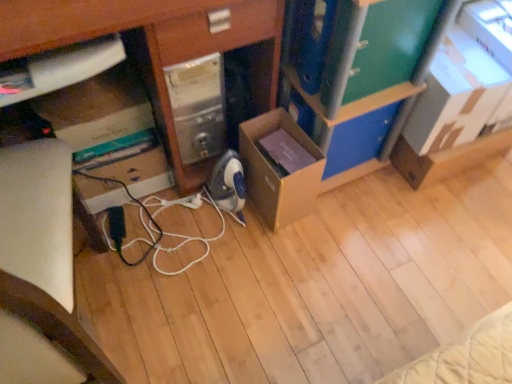
Question: From the image's perspective, is green matte drawer at upper right, the 1th drawer viewed from the top, above blue plastic drawer at center, which is the 1th drawer in bottom-to-top order?

Choices:
 (A) no
 (B) yes

Answer: (B)

Question: Does green matte drawer at upper right, arranged as the second drawer when viewed from the back, appear on the left side of blue plastic drawer at center, which is the 1th drawer in bottom-to-top order?

Choices:
 (A) yes
 (B) no

Answer: (A)

Question: Is blue plastic drawer at center, which is the 1th drawer in bottom-to-top order, a part of green matte drawer at upper right, arranged as the second drawer when viewed from the back?

Choices:
 (A) yes
 (B) no

Answer: (B)

Question: Does green matte drawer at upper right, the 2th drawer when ordered from bottom to top, have a lesser height compared to blue plastic drawer at center, which is the 1th drawer in bottom-to-top order?

Choices:
 (A) yes
 (B) no

Answer: (B)

Question: Is green matte drawer at upper right, the 1th drawer viewed from the top, thinner than blue plastic drawer at center, which ranks as the second drawer in top-to-bottom order?

Choices:
 (A) yes
 (B) no

Answer: (B)

Question: From a real-world perspective, is green matte drawer at upper right, the 1th drawer viewed from the top, on top of blue plastic drawer at center, which ranks as the second drawer in top-to-bottom order?

Choices:
 (A) yes
 (B) no

Answer: (A)

Question: Is the depth of cardboard box at upper right, which appears as the second cardboard box when viewed from the left, less than that of blue plastic drawer at center, which is the 1th drawer in bottom-to-top order?

Choices:
 (A) yes
 (B) no

Answer: (A)

Question: From a real-world perspective, does cardboard box at upper right, which appears as the second cardboard box when viewed from the left, stand above blue plastic drawer at center, which ranks as the second drawer in top-to-bottom order?

Choices:
 (A) no
 (B) yes

Answer: (B)

Question: Is cardboard box at upper right, the first cardboard box from the right, smaller than blue plastic drawer at center, which ranks as the second drawer in top-to-bottom order?

Choices:
 (A) yes
 (B) no

Answer: (B)

Question: Does cardboard box at upper right, which appears as the second cardboard box when viewed from the left, turn towards blue plastic drawer at center, the second drawer from the front?

Choices:
 (A) yes
 (B) no

Answer: (B)

Question: Is cardboard box at upper right, which appears as the second cardboard box when viewed from the left, further to the viewer compared to blue plastic drawer at center, which is the 1th drawer in bottom-to-top order?

Choices:
 (A) yes
 (B) no

Answer: (B)

Question: Considering the relative sizes of cardboard box at upper right, the first cardboard box from the right, and blue plastic drawer at center, the first drawer from the back, in the image provided, is cardboard box at upper right, the first cardboard box from the right, thinner than blue plastic drawer at center, the first drawer from the back,?

Choices:
 (A) no
 (B) yes

Answer: (A)

Question: From the image's perspective, is blue plastic drawer at center, which ranks as the second drawer in top-to-bottom order, under black rubber cable at center?

Choices:
 (A) no
 (B) yes

Answer: (A)